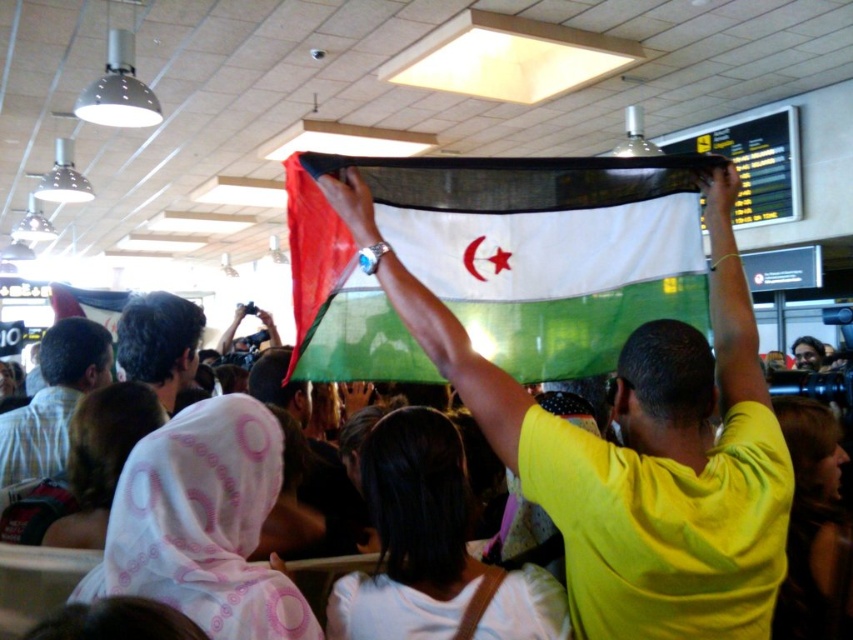
You are an airport security officer who needs to locate the green fabric flag at center. According to the coordinates provided, where should you look to find it?

The green fabric flag at center is located at coordinates point (498, 260).

You are an airport security agent checking the crowd in the scene. You need to locate the person wearing the light brown shirt at center and the person with dark brown hair at center. According to the scene description, which of these two individuals is positioned to the right?

The dark brown hair at center is positioned to the right of the light brown shirt at center.